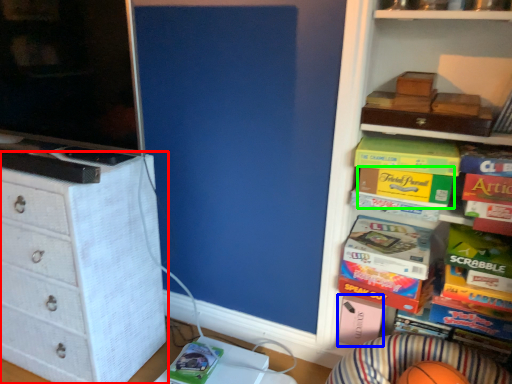
Question: Estimate the real-world distances between objects in this image. Which object is closer to chest of drawers (highlighted by a red box), box (highlighted by a blue box) or storage box (highlighted by a green box)?

Choices:
 (A) box
 (B) storage box

Answer: (A)